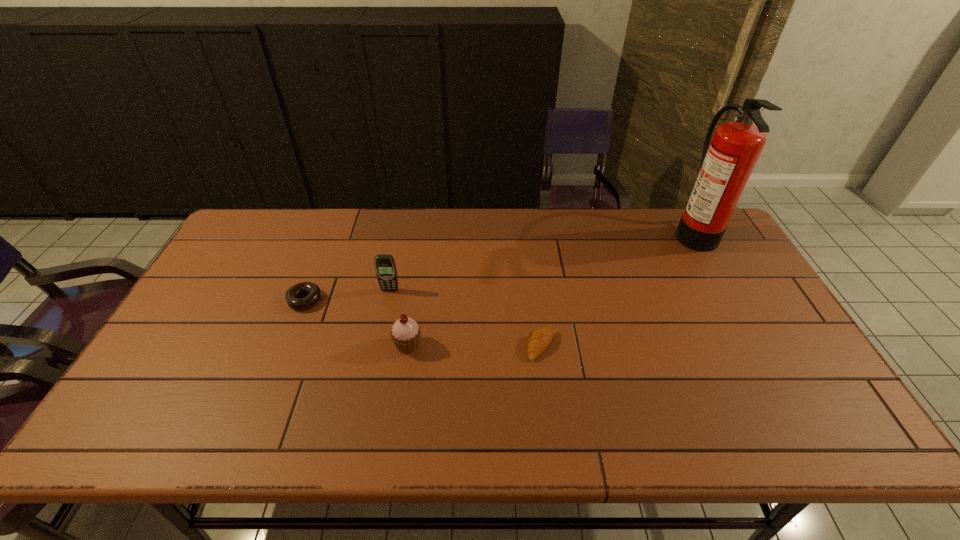
Where is `vacant region at the right edge of the desktop`? The height and width of the screenshot is (540, 960). vacant region at the right edge of the desktop is located at coordinates [x=691, y=256].

At what (x,y) coordinates should I click in order to perform the action: click on free space between the doughnut and the crescent roll. Please return your answer as a coordinate pair (x, y). The image size is (960, 540). Looking at the image, I should click on (423, 323).

The height and width of the screenshot is (540, 960). Identify the location of free space between the third object from right to left and the tallest object. (550, 289).

Locate an element on the screen. vacant space that is in between the third tallest object and the tallest object is located at coordinates (550, 289).

Locate an element on the screen. vacant space that's between the fourth object from right to left and the third object from right to left is located at coordinates coord(399,318).

Image resolution: width=960 pixels, height=540 pixels. In order to click on empty space between the third object from right to left and the rightmost object in this screenshot , I will do `click(550, 289)`.

Image resolution: width=960 pixels, height=540 pixels. Find the location of `empty space that is in between the cellular telephone and the crescent roll`. empty space that is in between the cellular telephone and the crescent roll is located at coordinates (466, 318).

You are a GUI agent. You are given a task and a screenshot of the screen. Output one action in this format:
    pyautogui.click(x=<x>, y=<y>)
    Task: Click on the vacant area that lies between the cupcake and the cellular telephone
    Image resolution: width=960 pixels, height=540 pixels.
    Given the screenshot: What is the action you would take?
    pyautogui.click(x=399, y=318)

Locate an element on the screen. This screenshot has width=960, height=540. empty space between the tallest object and the second object from left to right is located at coordinates (541, 261).

I want to click on empty space between the rightmost object and the second object from right to left, so click(617, 289).